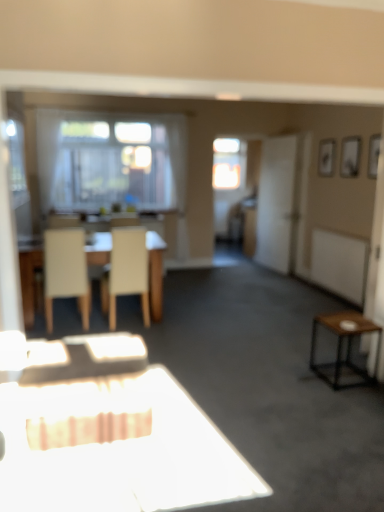
Question: Based on their sizes in the image, would you say transparent glass window at center is bigger or smaller than beige fabric chair at center, the first chair when ordered from right to left?

Choices:
 (A) small
 (B) big

Answer: (A)

Question: Is transparent glass window at center wider or thinner than beige fabric chair at center, which ranks as the second chair in left-to-right order?

Choices:
 (A) wide
 (B) thin

Answer: (B)

Question: Which is farther from the brown wooden side table at right?

Choices:
 (A) white matte chair at left, which appears as the second chair when viewed from the right
 (B) beige fabric chair at center, which ranks as the second chair in left-to-right order
 (C) transparent glass window at center
 (D) white matte screen door at right
 (E) light beige wood table at center

Answer: (C)

Question: Which of these objects is positioned closest to the light beige wood table at center?

Choices:
 (A) white matte screen door at right
 (B) brown wooden side table at right
 (C) beige fabric chair at center, which ranks as the second chair in left-to-right order
 (D) transparent glass window at center
 (E) white matte chair at left, which appears as the second chair when viewed from the right

Answer: (E)